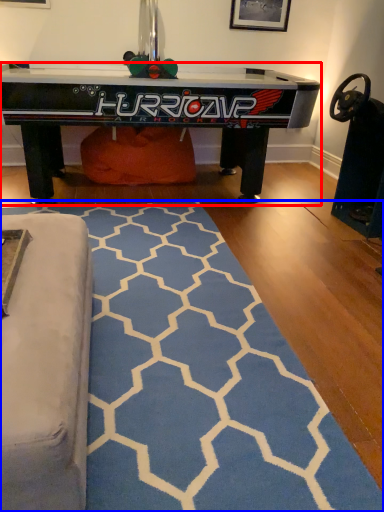
Question: Which object appears farthest to the camera in this image, table (highlighted by a red box) or mat (highlighted by a blue box)?

Choices:
 (A) table
 (B) mat

Answer: (A)